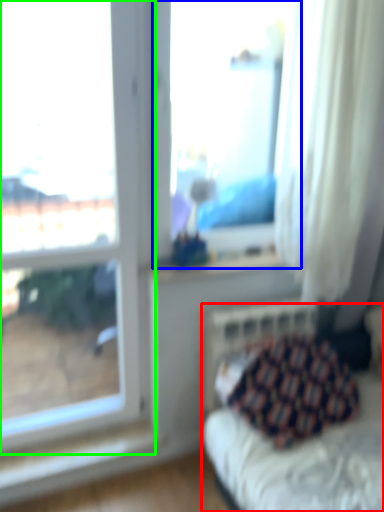
Question: Considering the real-world distances, which object is closest to furniture (highlighted by a red box)? window (highlighted by a blue box) or window (highlighted by a green box).

Choices:
 (A) window
 (B) window

Answer: (B)